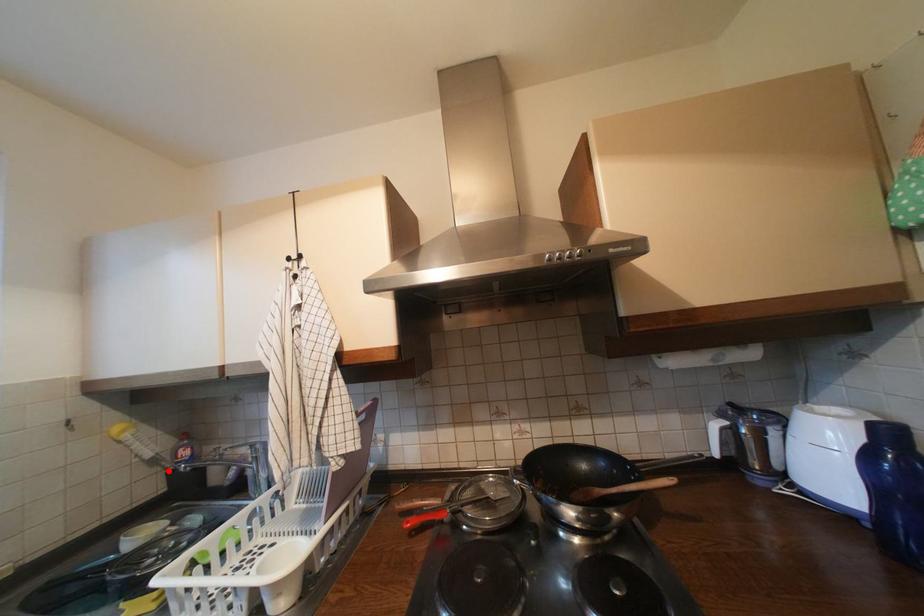
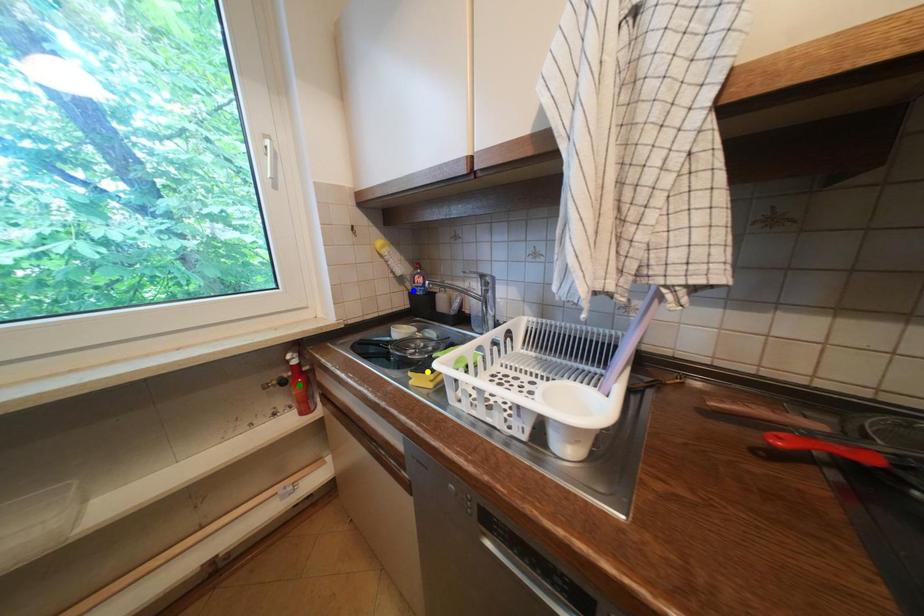
Question: I am providing you with two images of the same scene from different viewpoints. A red point is marked on the first image. You are given multiple points on the second image. Which point in image 2 is actually the same real-world point as the red point in image 1?

Choices:
 (A) blue point
 (B) yellow point
 (C) green point

Answer: (A)